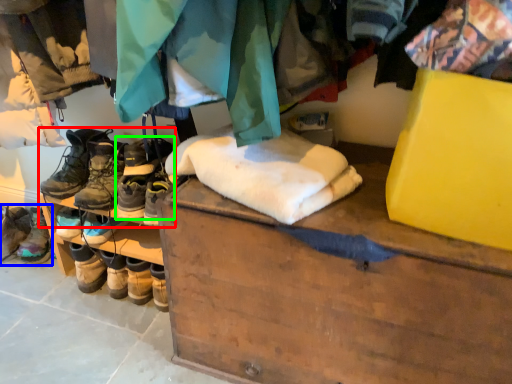
Question: Based on their relative distances, which object is nearer to footwear (highlighted by a red box)? Choose from footwear (highlighted by a blue box) and footwear (highlighted by a green box).

Choices:
 (A) footwear
 (B) footwear

Answer: (B)